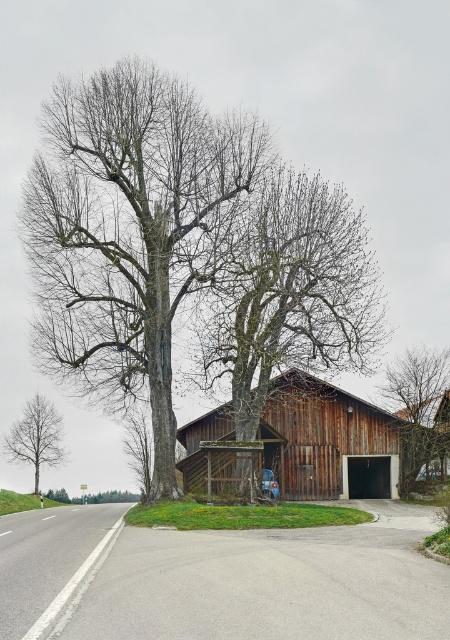
Question: Which object is closer to the camera taking this photo?

Choices:
 (A) wooden barn at center
 (B) smooth bark tree at center

Answer: (B)

Question: Is wooden barn at center smaller than smooth brown tree at center?

Choices:
 (A) no
 (B) yes

Answer: (A)

Question: Is bare wood tree at center to the right of wooden barn at center from the viewer's perspective?

Choices:
 (A) no
 (B) yes

Answer: (B)

Question: Which object is the farthest from the smooth bark tree at center?

Choices:
 (A) bare wood tree at center
 (B) wooden barn at center

Answer: (B)

Question: Does wooden barn at center appear over smooth gray tree at left?

Choices:
 (A) no
 (B) yes

Answer: (A)

Question: Estimate the real-world distances between objects in this image. Which object is closer to the bare wood tree at center?

Choices:
 (A) wooden barn at center
 (B) smooth bark tree at center
 (C) smooth brown tree at center
 (D) smooth gray tree at left

Answer: (B)